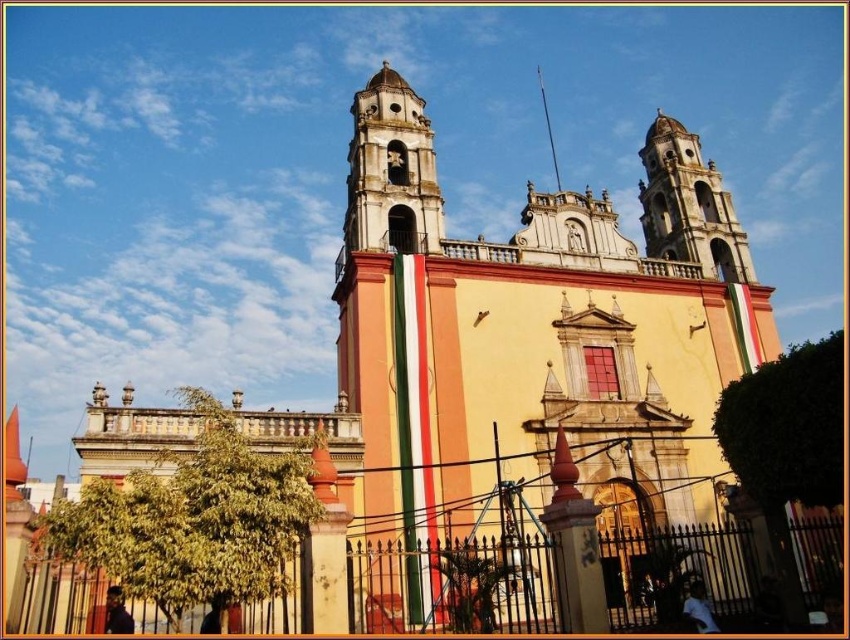
Does iron gate at lower center appear on the left side of white stone bell tower at center?

Incorrect, iron gate at lower center is not on the left side of white stone bell tower at center.

Who is lower down, iron gate at lower center or white stone bell tower at center?

Positioned lower is iron gate at lower center.

The image size is (850, 640). Describe the element at coordinates (452, 586) in the screenshot. I see `iron gate at lower center` at that location.

Locate an element on the screen. iron gate at lower center is located at coordinates (452, 586).

Does iron gate at lower center have a greater width compared to smooth stone bell tower at upper right?

Correct, the width of iron gate at lower center exceeds that of smooth stone bell tower at upper right.

Can you confirm if iron gate at lower center is positioned below smooth stone bell tower at upper right?

Indeed, iron gate at lower center is positioned under smooth stone bell tower at upper right.

Does point (756, 593) come in front of point (661, 186)?

Yes, it is.

The height and width of the screenshot is (640, 850). Find the location of `iron gate at lower center`. iron gate at lower center is located at coordinates point(452,586).

From the picture: Does white stone bell tower at center have a greater width compared to smooth stone bell tower at upper right?

No, white stone bell tower at center is not wider than smooth stone bell tower at upper right.

Is white stone bell tower at center smaller than smooth stone bell tower at upper right?

Yes, white stone bell tower at center is smaller than smooth stone bell tower at upper right.

What do you see at coordinates (391, 170) in the screenshot?
I see `white stone bell tower at center` at bounding box center [391, 170].

Where is `white stone bell tower at center`? The height and width of the screenshot is (640, 850). white stone bell tower at center is located at coordinates (391, 170).